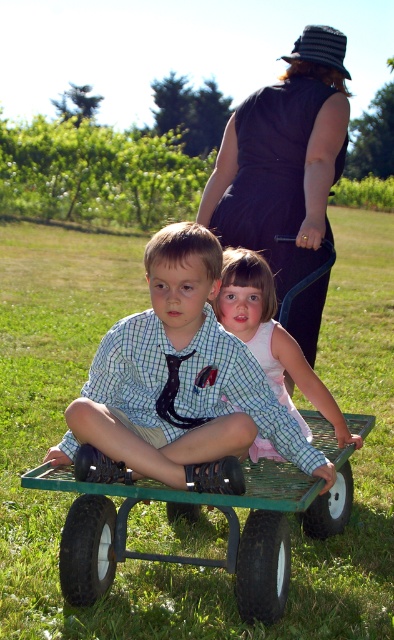
You are a photographer trying to capture both the checkered fabric shirt at center and the dark blue dress at center in a single frame. Which object should you focus on to ensure both are visible without cropping?

You should focus on the dark blue dress at center since it occupies more space than the checkered fabric shirt at center, allowing both to fit within the frame.

You are a photographer standing to the side of the wagon. You want to take a photo that includes both the checkered fabric shirt at center and the green metal wagon at center. Which object should you zoom in on to ensure both are in frame without moving your position?

You should zoom in on the checkered fabric shirt at center because it is smaller in width compared to the green metal wagon at center, so focusing on it would help capture both objects within the frame.